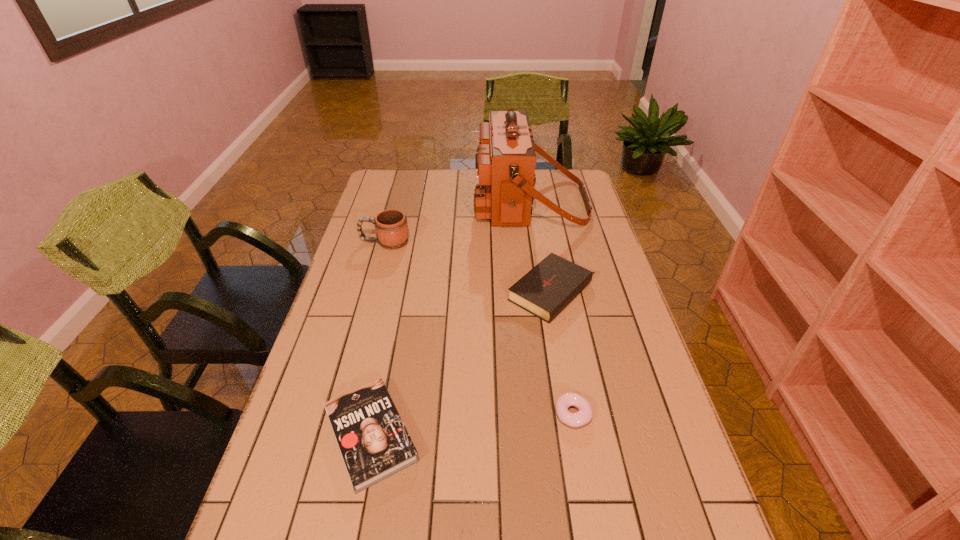
The image size is (960, 540). Identify the location of the tallest object. (505, 161).

I want to click on mug, so click(x=391, y=226).

The image size is (960, 540). Identify the location of Bible. 552,284.

This screenshot has width=960, height=540. I want to click on the third nearest object, so click(x=552, y=284).

Identify the location of doughnut. This screenshot has width=960, height=540. (584, 415).

Identify the location of book. (374, 443).

The height and width of the screenshot is (540, 960). I want to click on free spot located on the face side of the satchel, so click(x=409, y=202).

Find the location of a particular element. Image resolution: width=960 pixels, height=540 pixels. vacant space situated on the face side of the satchel is located at coordinates (426, 202).

Find the location of a particular element. The height and width of the screenshot is (540, 960). vacant space positioned 0.380m on the face side of the satchel is located at coordinates (379, 202).

I want to click on vacant space located on the back of the third nearest object, so click(x=538, y=205).